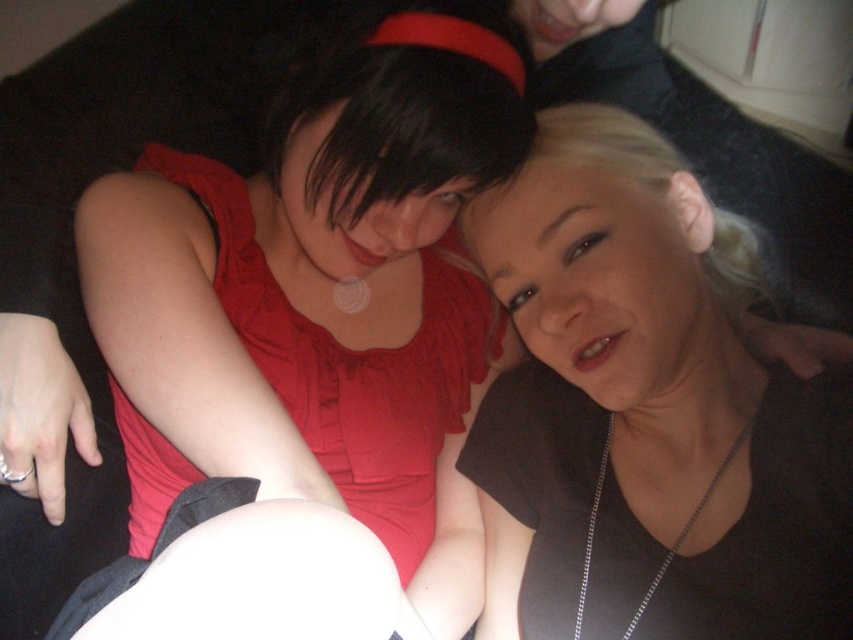
Question: Can you confirm if matte red dress at center is positioned to the left of matte black shirt at center?

Choices:
 (A) no
 (B) yes

Answer: (B)

Question: Which point is farther to the camera?

Choices:
 (A) matte red dress at center
 (B) silver chain necklace at center
 (C) matte black shirt at center

Answer: (B)

Question: Does matte red dress at center appear over matte black shirt at center?

Choices:
 (A) no
 (B) yes

Answer: (A)

Question: Which object is the farthest from the silver chain necklace at center?

Choices:
 (A) matte red dress at center
 (B) matte black shirt at center

Answer: (A)

Question: Which is nearer to the matte red dress at center?

Choices:
 (A) silver chain necklace at center
 (B) matte black shirt at center

Answer: (B)

Question: Can you confirm if matte black shirt at center is bigger than silver chain necklace at center?

Choices:
 (A) yes
 (B) no

Answer: (A)